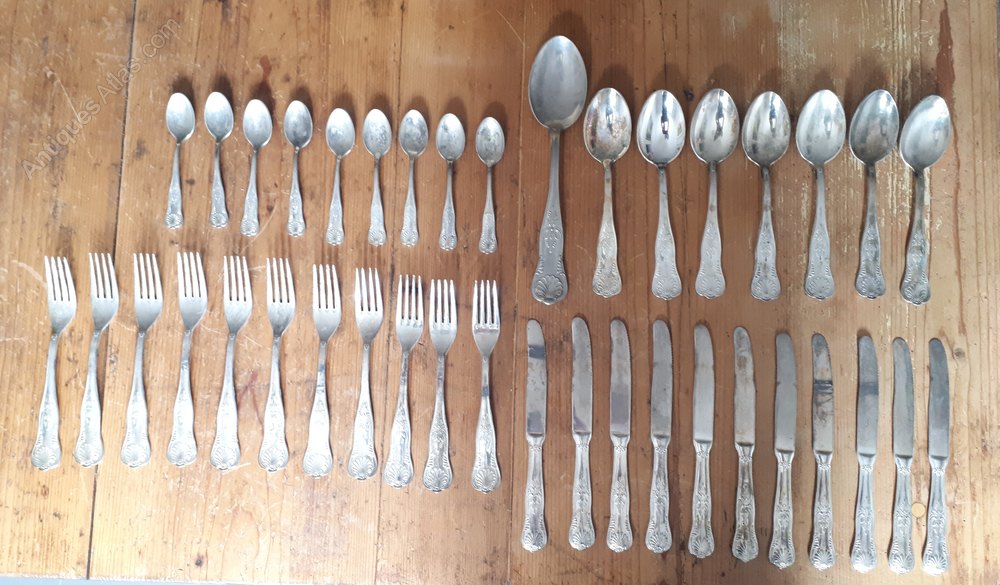
Identify the location of teaspoons. This screenshot has width=1000, height=585. (181, 117), (221, 118), (259, 123), (295, 126), (341, 132), (373, 136), (410, 139), (451, 139), (493, 141).